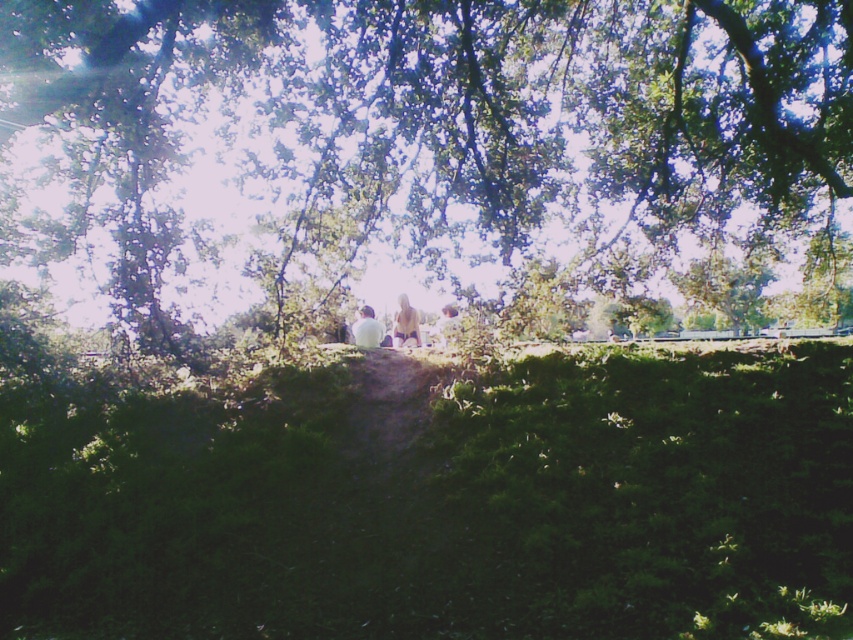
You are a photographer trying to capture a candid shot of two people sitting on the grass. You notice the light brown fabric dress at center and the white matte shirt at center. Which clothing item is positioned higher relative to the other?

The light brown fabric dress at center is above the white matte shirt at center, so it is positioned higher.

You are a photographer aiming to capture the white matte shirt at center and the green mossy hedge at upper center in a single frame. Based on their widths, which object should you position closer to the center of the photo to ensure both are fully visible?

The green mossy hedge at upper center is wider than the white matte shirt at center. To ensure both are fully visible in the frame, position the green mossy hedge at upper center closer to the center of the photo since its greater width requires more space.